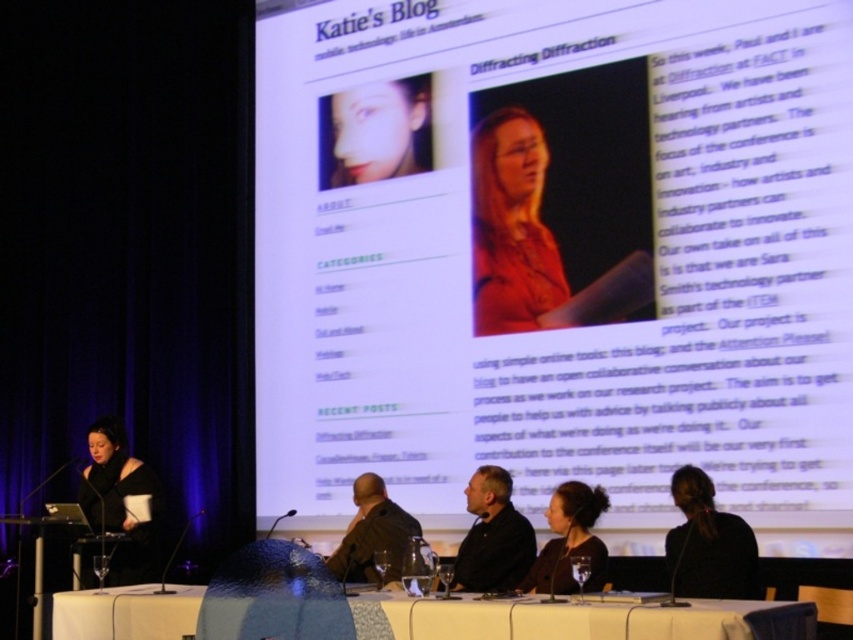
From the picture: Looking at the table where the four individuals are seated, you notice a blue spherical object and some glasses. If you were to move the blue spherical object to the position currently occupied by the dark brown hair at center, where would it be relative to the smooth skin face at upper center?

The dark brown hair at center is to the right of the smooth skin face at upper center, so moving the blue spherical object there would place it to the right of the smooth skin face at upper center.

You are standing in the conference room and want to find the matte orange shirt at center. Where is it located in terms of coordinates?

The matte orange shirt at center is located at coordinates point [514,228].

You are a photographer standing at the back of the conference room. You want to take a photo of the smooth skin face at upper center and dark brown hair at center so that both are in focus. The camera you are using has a depth of field that can cover 3.5 meters. Will both subjects be in focus?

The distance between the smooth skin face at upper center and dark brown hair at center is 3.61 meters, which exceeds the camera depth of field of 3.5 meters. Therefore, both subjects cannot be in focus simultaneously.